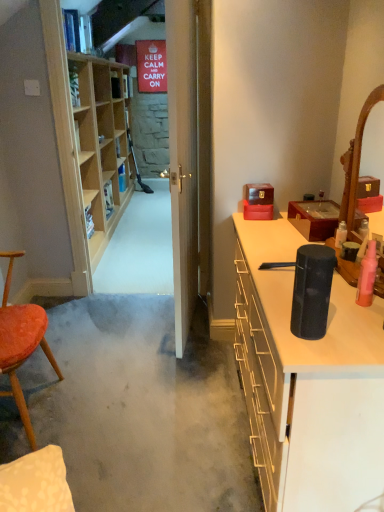
What are the coordinates of `free space to the right of black matte speaker at right` in the screenshot? It's located at (352, 328).